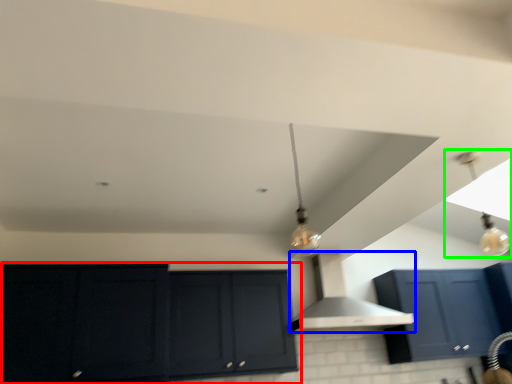
Question: Which object is the closest to the cabinetry (highlighted by a red box)? Choose among these: vent (highlighted by a blue box) or light fixture (highlighted by a green box).

Choices:
 (A) vent
 (B) light fixture

Answer: (A)